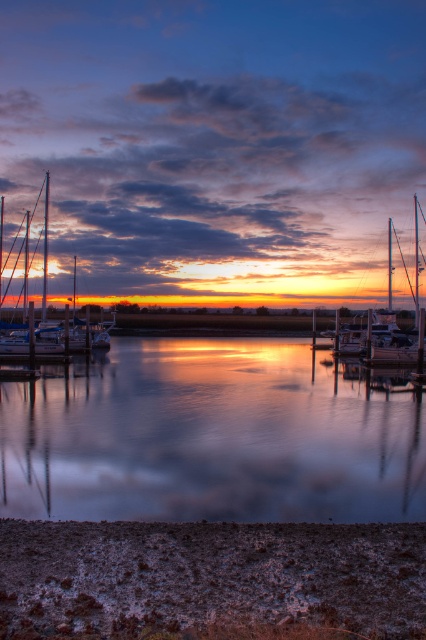
You are a photographer planning to capture the marina scene. You have a camera with a wide angle lens that can capture large objects clearly. Which of the two sailboats, the shiny white sailboat at left or the white glossy sailboat at center, would be better suited for your shot considering the lens preference?

The shiny white sailboat at left is larger in size than the white glossy sailboat at center, making it better suited for the wide angle lens which captures large objects clearly.

You are an artist planning to paint the marina scene. You want to ensure the glistening water at center and the white glossy sailboat at center are proportionally accurate. Based on the scene, which object should you paint as the smaller one?

The glistening water at center should be painted as the smaller one since it has a smaller size compared to the white glossy sailboat at center according to the description.